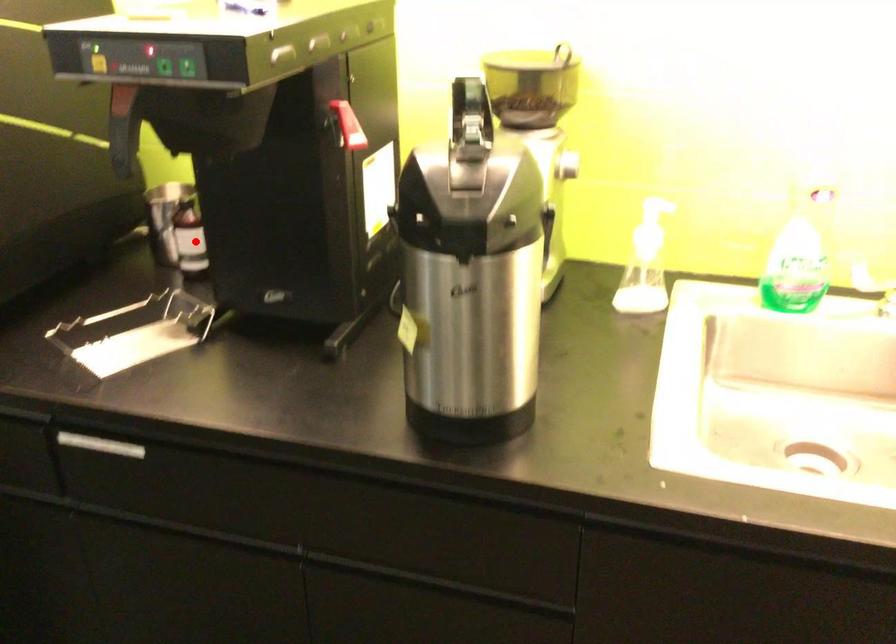
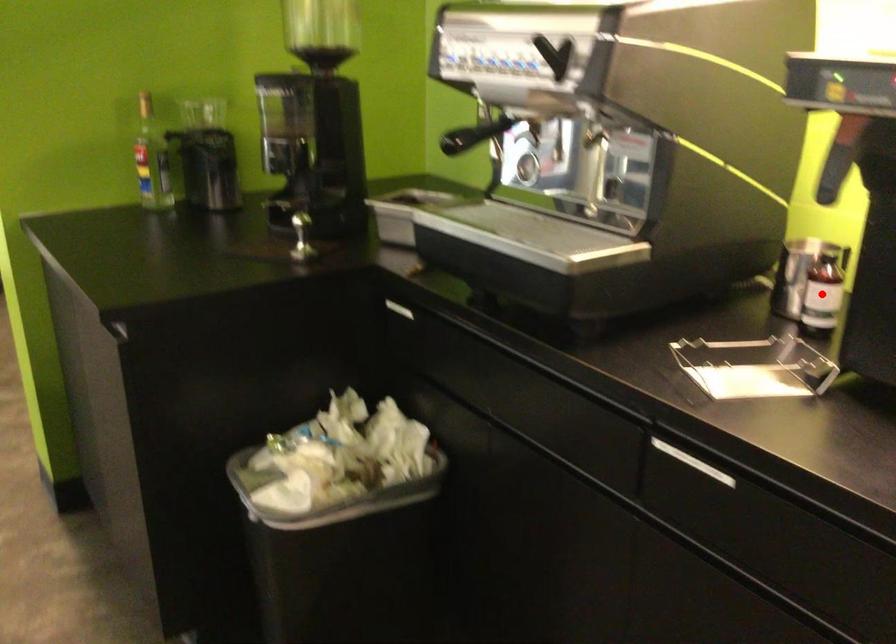
I am providing you with two images of the same scene from different viewpoints. A red point is marked on the first image and another point is marked on the second image. Is the marked point in image1 the same physical position as the marked point in image2?

Yes